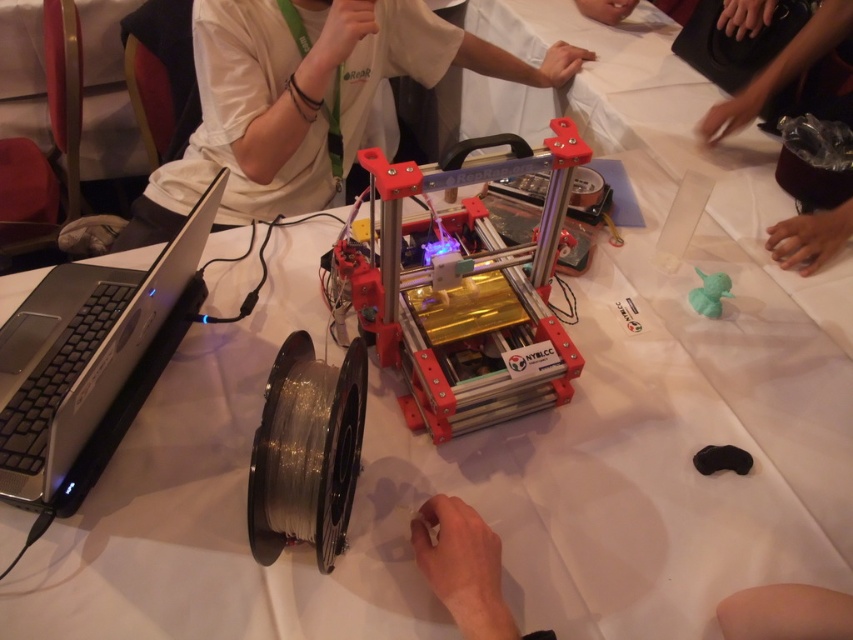
Which is behind, point (112, 394) or point (706, 314)?

The point (706, 314) is more distant.

Based on the photo, can you confirm if silver/black plastic laptop at left is bigger than matte green plastic toy at center-right?

Yes.

Does point (50, 348) lie behind point (706, 288)?

No, (50, 348) is closer to viewer.

Where is `silver/black plastic laptop at left`? silver/black plastic laptop at left is located at coordinates (82, 353).

Is white cotton shirt at upper center further to the viewer compared to metallic red printer at center?

Yes, it is behind metallic red printer at center.

Can you confirm if white cotton shirt at upper center is shorter than metallic red printer at center?

No, white cotton shirt at upper center is not shorter than metallic red printer at center.

Is point (375, 76) in front of point (540, 380)?

No.

This screenshot has height=640, width=853. Find the location of `white cotton shirt at upper center`. white cotton shirt at upper center is located at coordinates (305, 100).

Measure the distance between metallic red printer at center and matte green plastic toy at center-right.

The distance of metallic red printer at center from matte green plastic toy at center-right is 17.50 inches.

Is point (463, 224) positioned behind point (717, 298)?

No, (463, 224) is closer to viewer.

Find the location of a particular element. metallic red printer at center is located at coordinates (467, 292).